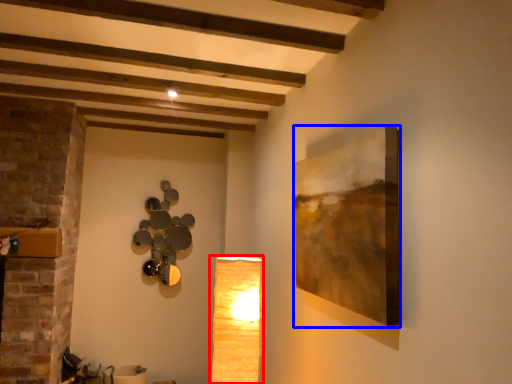
Question: Which point is further to the camera, lamp (highlighted by a red box) or picture frame (highlighted by a blue box)?

Choices:
 (A) lamp
 (B) picture frame

Answer: (A)